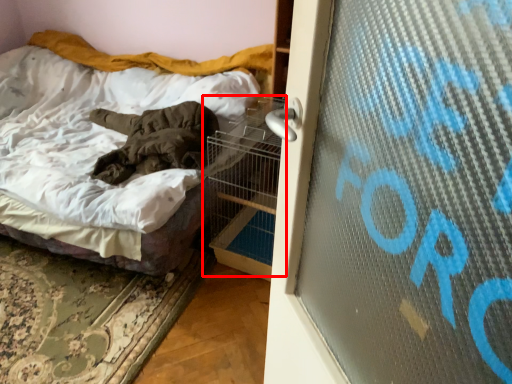
Question: Considering the relative positions of bird cage (annotated by the red box) and bed in the image provided, where is bird cage (annotated by the red box) located with respect to the staircase?

Choices:
 (A) right
 (B) left

Answer: (A)